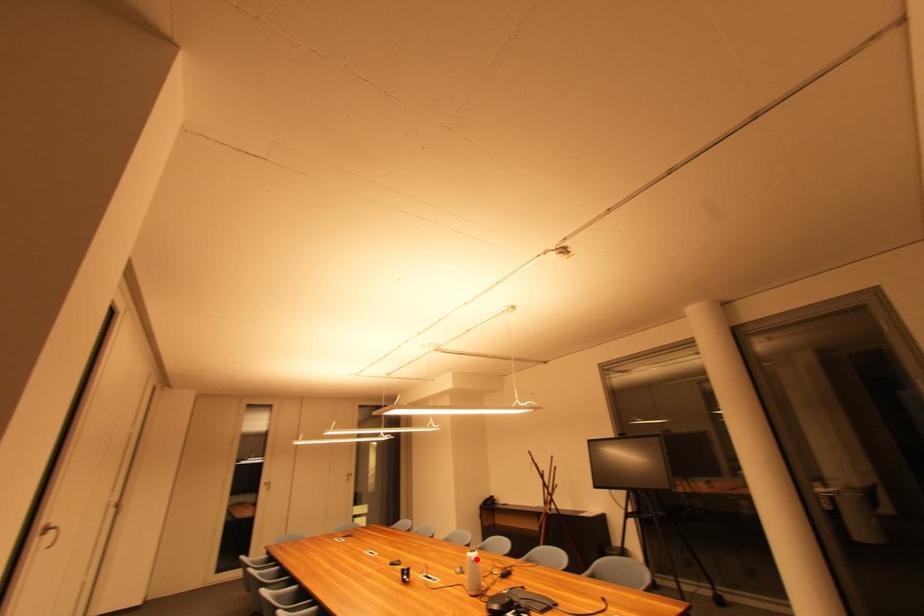
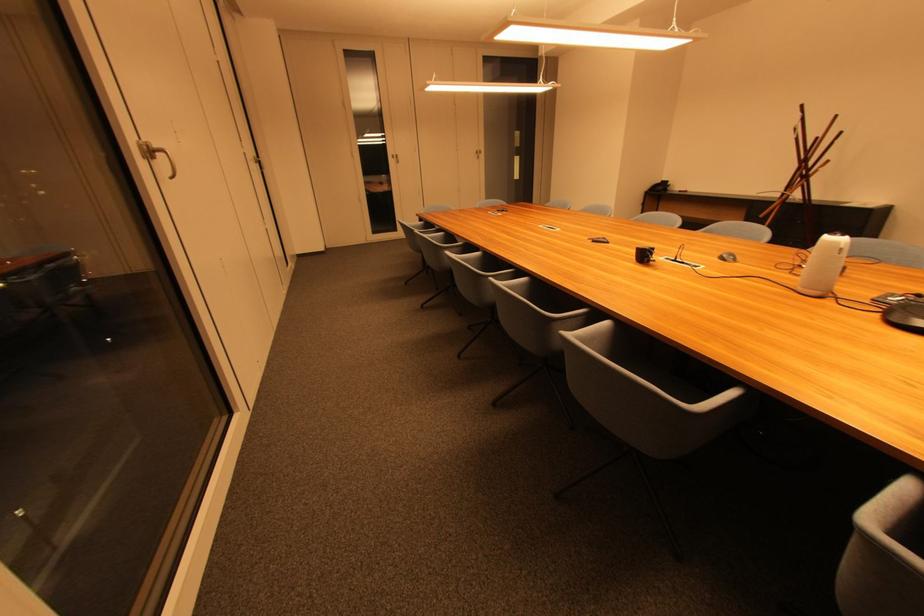
The point at the highlighted location is marked in the first image. Where is the corresponding point in the second image?

(841, 245)